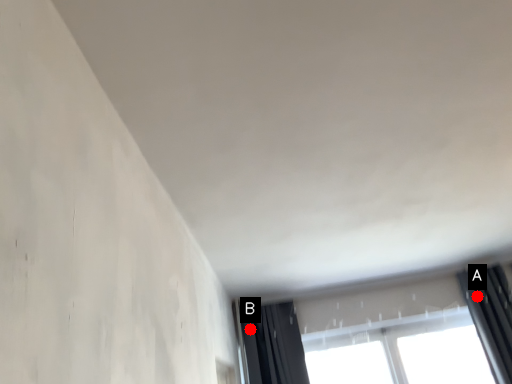
Question: Two points are circled on the image, labeled by A and B beside each circle. Which point is closer to the camera?

Choices:
 (A) A is closer
 (B) B is closer

Answer: (A)